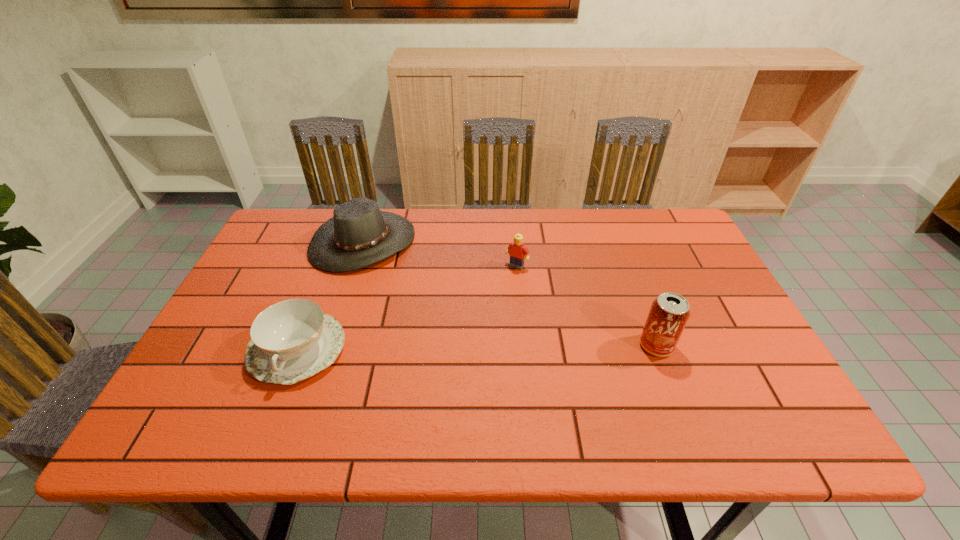
Identify the location of empty space that is in between the chinaware and the second object from right to left. (407, 307).

Where is `vacant region between the chinaware and the tallest object`? vacant region between the chinaware and the tallest object is located at coordinates (477, 347).

Where is `free space that is in between the shortest object and the rightmost object`? The height and width of the screenshot is (540, 960). free space that is in between the shortest object and the rightmost object is located at coordinates (477, 347).

You are a GUI agent. You are given a task and a screenshot of the screen. Output one action in this format:
    pyautogui.click(x=<x>, y=<y>)
    Task: Click on the free point between the rightmost object and the second object from right to left
    
    Given the screenshot: What is the action you would take?
    [x=587, y=306]

Identify which object is the nearest to the Lego. Please provide its 2D coordinates. Your answer should be formatted as a tuple, i.e. [(x, y)], where the tuple contains the x and y coordinates of a point satisfying the conditions above.

[(359, 234)]

Identify which object is the nearest to the Lego. Please provide its 2D coordinates. Your answer should be formatted as a tuple, i.e. [(x, y)], where the tuple contains the x and y coordinates of a point satisfying the conditions above.

[(359, 234)]

Locate an element on the screen. free space that satisfies the following two spatial constraints: 1. on the front side of the hat; 2. on the left side of the Lego is located at coordinates (355, 266).